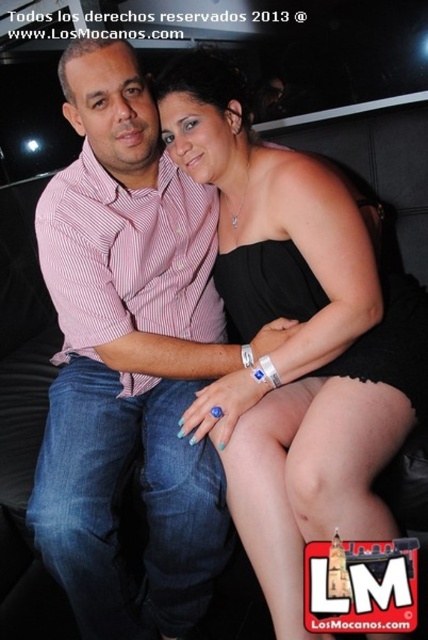
Is pink striped shirt at center bigger than black satin dress at center?

Yes.

Can you confirm if pink striped shirt at center is thinner than black satin dress at center?

Indeed, pink striped shirt at center has a lesser width compared to black satin dress at center.

Is point (158, 193) positioned after point (425, 336)?

Yes, point (158, 193) is farther from viewer.

Locate an element on the screen. This screenshot has width=428, height=640. pink striped shirt at center is located at coordinates (130, 353).